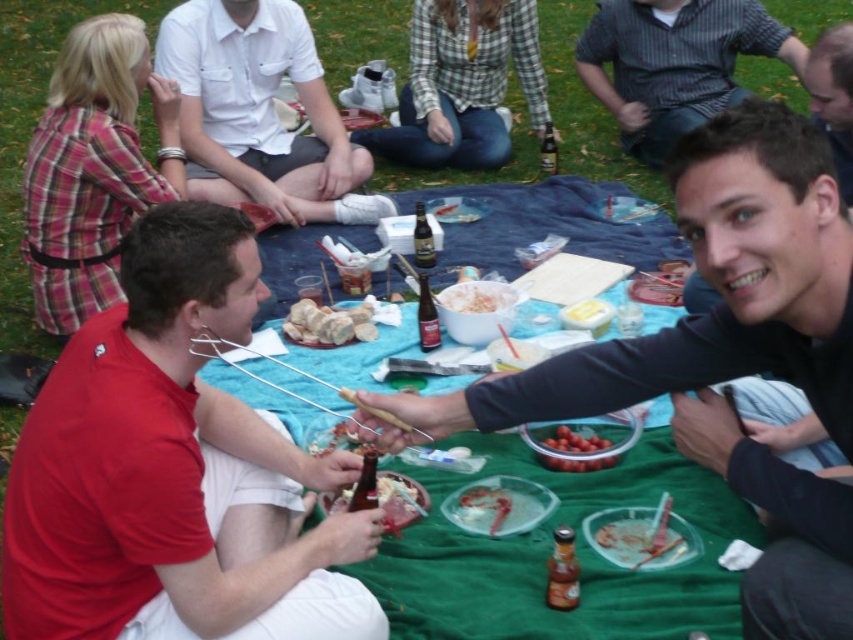
Measure the distance between striped cotton shirt at upper right and translucent plastic plate at lower center.

A distance of 2.63 meters exists between striped cotton shirt at upper right and translucent plastic plate at lower center.

Which is more to the right, striped cotton shirt at upper right or translucent plastic plate at lower center?

Positioned to the right is striped cotton shirt at upper right.

Identify the location of striped cotton shirt at upper right. The image size is (853, 640). (674, 61).

Does smooth black shirt at center appear under translucent plastic plate at center?

No.

Which is in front, point (757, 616) or point (518, 532)?

Positioned in front is point (757, 616).

Image resolution: width=853 pixels, height=640 pixels. I want to click on smooth black shirt at center, so click(728, 355).

Is white crumbly bread at center below shiny red tomatoes at center?

Actually, white crumbly bread at center is above shiny red tomatoes at center.

Which is above, white crumbly bread at center or shiny red tomatoes at center?

white crumbly bread at center is higher up.

Measure the distance between point (328, 332) and camera.

2.82 meters

Image resolution: width=853 pixels, height=640 pixels. Identify the location of white crumbly bread at center. (328, 323).